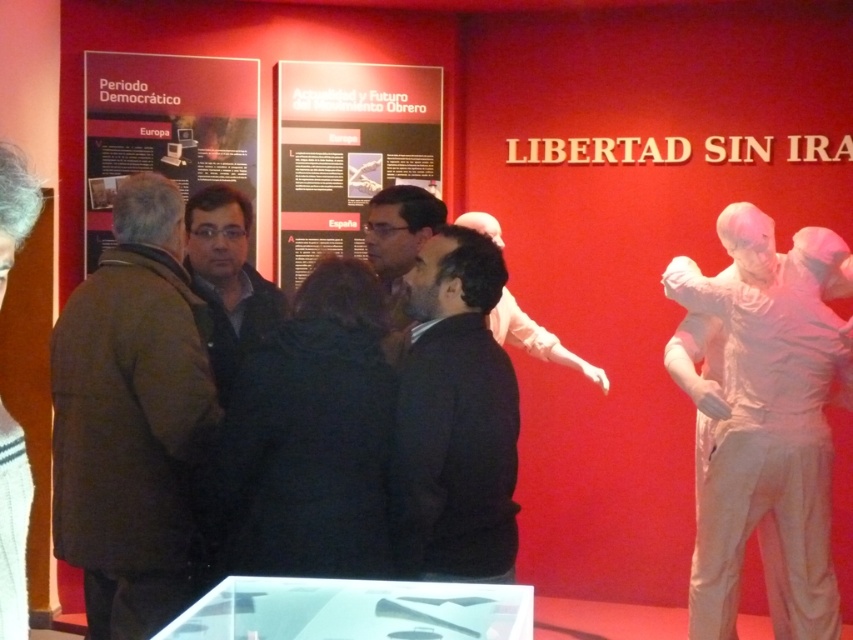
Question: Which is farther from the matte black poster at center?

Choices:
 (A) matte black poster at left
 (B) black matte jacket at center
 (C) matte black jacket at center

Answer: (B)

Question: Based on their relative distances, which object is nearer to the dark gray jacket at center?

Choices:
 (A) matte black jacket at center
 (B) white glossy statue at right

Answer: (B)

Question: Which of the following is the farthest from the observer?

Choices:
 (A) matte black jacket at center
 (B) dark gray jacket at center
 (C) brown woolen coat at left
 (D) white glossy statue at right

Answer: (B)

Question: Can you confirm if brown woolen coat at left is positioned to the right of matte black poster at left?

Choices:
 (A) no
 (B) yes

Answer: (B)

Question: Does black matte jacket at center lie behind matte black jacket at center?

Choices:
 (A) yes
 (B) no

Answer: (B)

Question: Observing the image, what is the correct spatial positioning of white glossy statue at right in reference to dark gray jacket at center?

Choices:
 (A) below
 (B) above

Answer: (A)